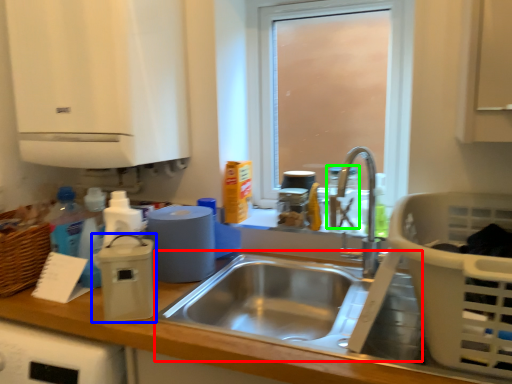
Question: Which object is the closest to the sink (highlighted by a red box)? Choose among these: appliance (highlighted by a blue box) or bottle (highlighted by a green box).

Choices:
 (A) appliance
 (B) bottle

Answer: (A)